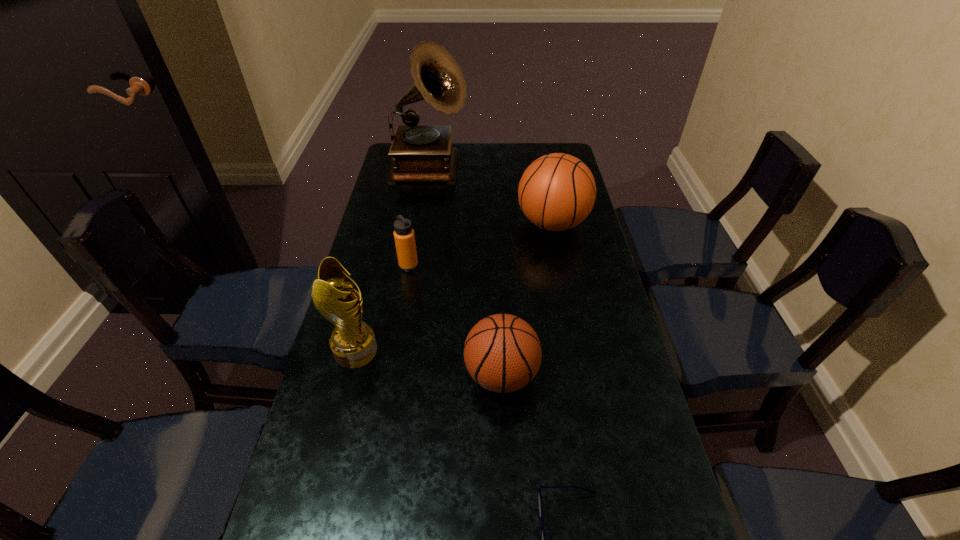
In the image, there is a desktop. Identify the location of vacant space at the far edge. The image size is (960, 540). (522, 151).

Where is `vacant point at the left edge`? The width and height of the screenshot is (960, 540). vacant point at the left edge is located at coordinates (389, 192).

This screenshot has width=960, height=540. Find the location of `vacant area at the right edge`. vacant area at the right edge is located at coordinates [x=588, y=219].

I want to click on free space that is in between the taller basketball and the thermos bottle, so click(x=481, y=245).

Identify the location of vacant region between the third farthest object and the shorter basketball. (455, 320).

Identify the location of empty location between the nearer basketball and the fifth nearest object. (527, 300).

Identify the location of empty location between the tallest object and the second farthest object. This screenshot has height=540, width=960. (492, 197).

You are a GUI agent. You are given a task and a screenshot of the screen. Output one action in this format:
    pyautogui.click(x=<x>, y=<y>)
    Task: Click on the vacant space that is in between the award and the shorter basketball
    
    Given the screenshot: What is the action you would take?
    pyautogui.click(x=428, y=363)

The height and width of the screenshot is (540, 960). I want to click on object that is the fifth closest to the award, so click(x=421, y=153).

At what (x,y) coordinates should I click in order to perform the action: click on object that stands as the second closest to the spectacles. Please return your answer as a coordinate pair (x, y). This screenshot has width=960, height=540. Looking at the image, I should click on point(353,343).